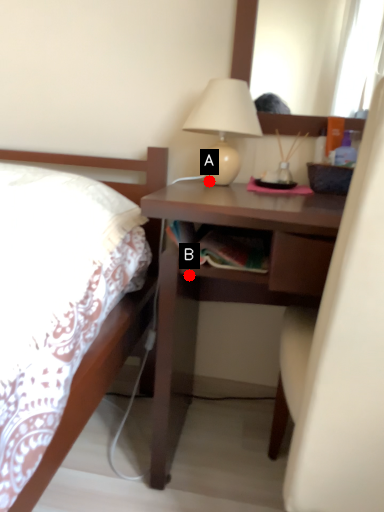
Question: Two points are circled on the image, labeled by A and B beside each circle. Which point is farther to the camera?

Choices:
 (A) A is further
 (B) B is further

Answer: (A)